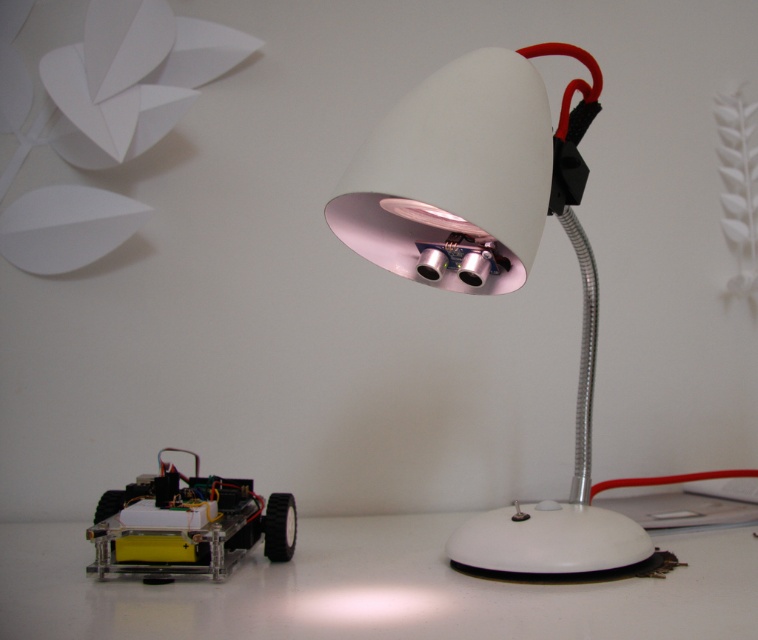
Does white glossy table at lower left appear on the left side of white glossy desk lamp at center?

Indeed, white glossy table at lower left is positioned on the left side of white glossy desk lamp at center.

Who is more distant from viewer, (471, 621) or (572, 214)?

Point (572, 214)

The height and width of the screenshot is (640, 758). In order to click on white glossy table at lower left in this screenshot , I will do `click(371, 589)`.

Who is positioned more to the right, white glossy desk lamp at center or clear acrylic toy car at lower left?

white glossy desk lamp at center

Is white glossy desk lamp at center bigger than clear acrylic toy car at lower left?

Indeed, white glossy desk lamp at center has a larger size compared to clear acrylic toy car at lower left.

Find the location of a particular element. The image size is (758, 640). white glossy desk lamp at center is located at coordinates (492, 257).

Describe the element at coordinates (371, 589) in the screenshot. I see `white glossy table at lower left` at that location.

Can you confirm if white glossy table at lower left is thinner than clear acrylic toy car at lower left?

No.

This screenshot has height=640, width=758. In order to click on white glossy table at lower left in this screenshot , I will do `click(371, 589)`.